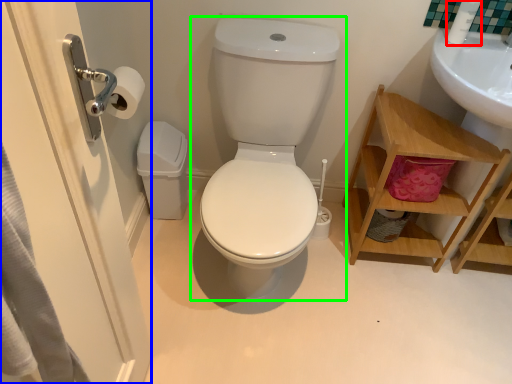
Question: Which object is positioned closest to toiletry (highlighted by a red box)? Select from screen door (highlighted by a blue box) and toilet (highlighted by a green box).

Choices:
 (A) screen door
 (B) toilet

Answer: (B)